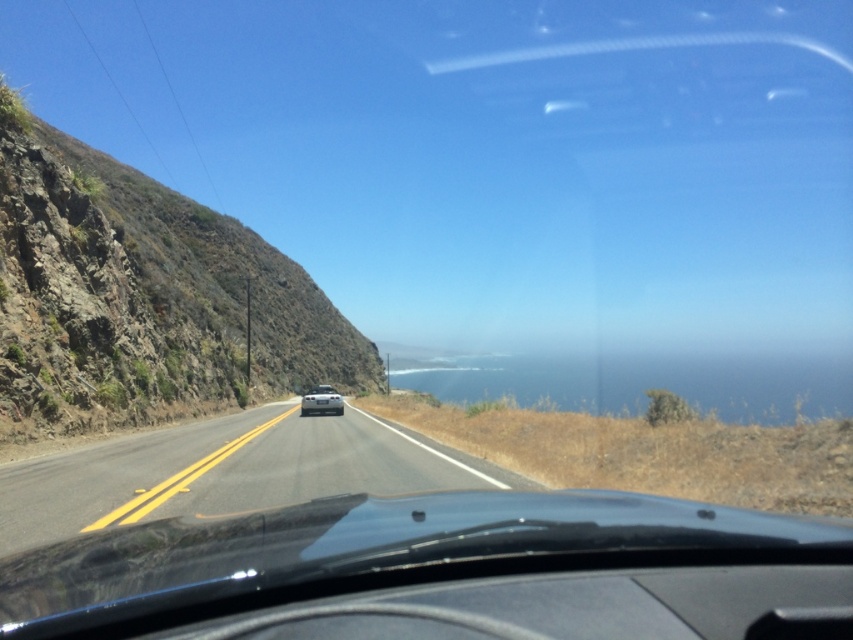
Question: Which point is farther to the camera?

Choices:
 (A) black asphalt road at center
 (B) dry grass at right
 (C) silver metallic car at center

Answer: (C)

Question: Is rugged rock cliff at left wider than silver metallic car at center?

Choices:
 (A) yes
 (B) no

Answer: (A)

Question: Which point is closer to the camera?

Choices:
 (A) (332, 392)
 (B) (33, 518)
 (C) (16, 420)
 (D) (373, 404)

Answer: (B)

Question: Is rugged rock cliff at left to the left of black asphalt road at center from the viewer's perspective?

Choices:
 (A) yes
 (B) no

Answer: (A)

Question: Is rugged rock cliff at left positioned in front of dry grass at right?

Choices:
 (A) yes
 (B) no

Answer: (B)

Question: Among these objects, which one is farthest from the camera?

Choices:
 (A) rugged rock cliff at left
 (B) silver metallic car at center
 (C) black asphalt road at center

Answer: (B)